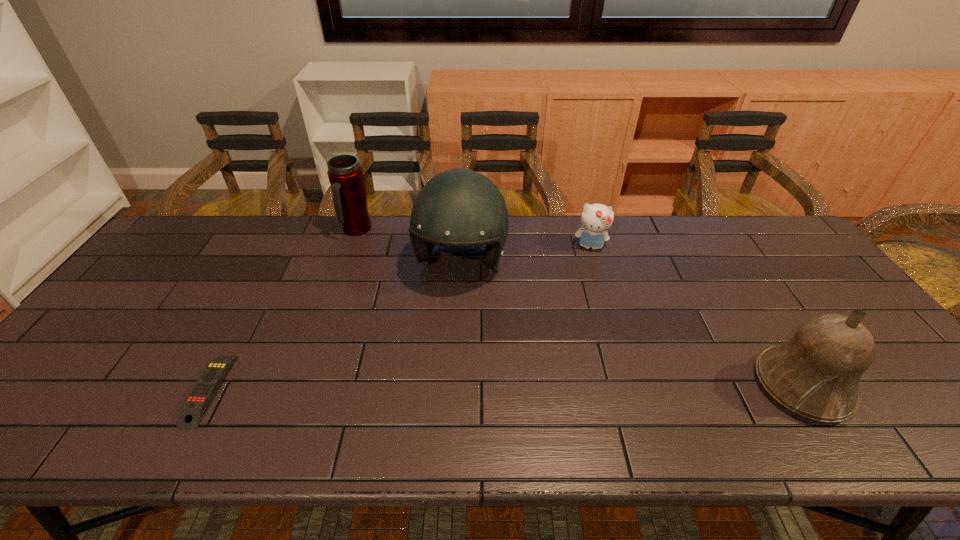
Identify the location of the shortest object. (191, 412).

This screenshot has width=960, height=540. Find the location of `remote control`. remote control is located at coordinates [191, 412].

Locate an element on the screen. The height and width of the screenshot is (540, 960). bell is located at coordinates (815, 374).

The height and width of the screenshot is (540, 960). Find the location of `the tallest object`. the tallest object is located at coordinates (458, 207).

I want to click on the third object from left to right, so click(x=458, y=207).

At what (x,y) coordinates should I click in order to perform the action: click on the second object from left to right. Please return your answer as a coordinate pair (x, y). Looking at the image, I should click on (345, 174).

Locate an element on the screen. The image size is (960, 540). kitten is located at coordinates (596, 219).

The width and height of the screenshot is (960, 540). Find the location of `the fourth tallest object`. the fourth tallest object is located at coordinates (596, 219).

Locate an element on the screen. The height and width of the screenshot is (540, 960). vacant space located 0.330m on the left of the leftmost object is located at coordinates (54, 390).

Locate an element on the screen. free space located on the back of the bell is located at coordinates (755, 313).